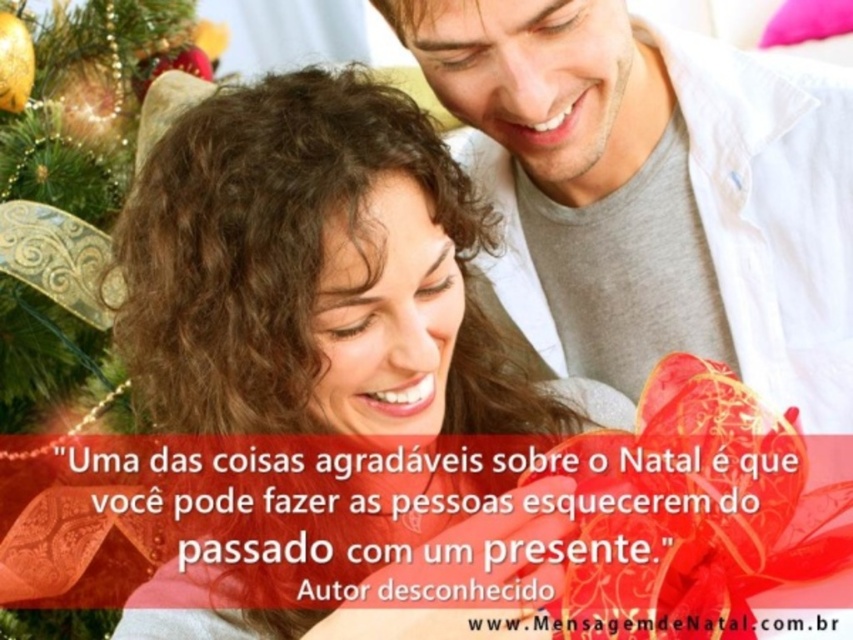
Can you confirm if white cotton shirt at upper right is taller than shiny red ribbon at upper left?

Incorrect, white cotton shirt at upper right's height is not larger of shiny red ribbon at upper left's.

Who is shorter, white cotton shirt at upper right or shiny red ribbon at upper left?

With less height is white cotton shirt at upper right.

Image resolution: width=853 pixels, height=640 pixels. What do you see at coordinates (654, 193) in the screenshot?
I see `white cotton shirt at upper right` at bounding box center [654, 193].

Identify the location of white cotton shirt at upper right. (654, 193).

Does white cotton shirt at upper right have a larger size compared to curly hair at center?

Incorrect, white cotton shirt at upper right is not larger than curly hair at center.

Who is higher up, white cotton shirt at upper right or curly hair at center?

white cotton shirt at upper right

Find the location of a particular element. white cotton shirt at upper right is located at coordinates (654, 193).

Where is `white cotton shirt at upper right`? white cotton shirt at upper right is located at coordinates (654, 193).

Which is behind, point (277, 102) or point (32, 179)?

Point (32, 179)

Which is in front, point (131, 236) or point (78, 65)?

Point (131, 236) is more forward.

This screenshot has width=853, height=640. I want to click on curly hair at center, so click(x=318, y=275).

Where is `curly hair at center`? Image resolution: width=853 pixels, height=640 pixels. curly hair at center is located at coordinates [x=318, y=275].